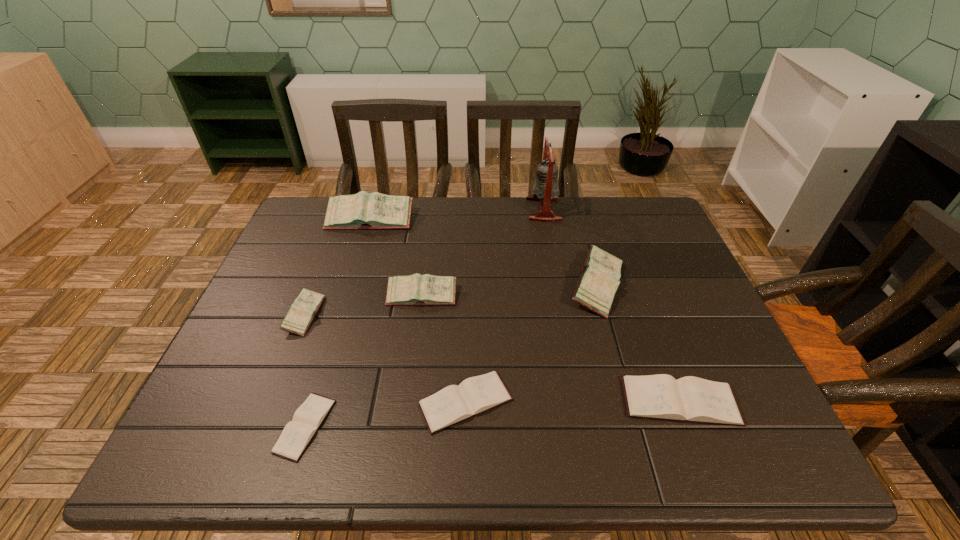
Where is `the rightmost brown diary`? Image resolution: width=960 pixels, height=540 pixels. the rightmost brown diary is located at coordinates (688, 399).

Where is `the seventh tallest object`? The height and width of the screenshot is (540, 960). the seventh tallest object is located at coordinates (455, 403).

Locate an element on the screen. the second smallest brown diary is located at coordinates (455, 403).

Where is `the leftmost brown diary`? This screenshot has width=960, height=540. the leftmost brown diary is located at coordinates (297, 434).

Identify the location of the shortest object. (297, 434).

Locate an element on the screen. vacant space situated 0.210m on the front of the bell is located at coordinates (555, 269).

Identify the location of vacant space positioned 0.300m on the right of the tallest diary. Image resolution: width=960 pixels, height=540 pixels. (510, 220).

Image resolution: width=960 pixels, height=540 pixels. What are the coordinates of `vacant region located 0.100m on the back of the third smallest pink diary` in the screenshot? It's located at (583, 234).

At what (x,y) coordinates should I click in order to perform the action: click on free spot located on the left of the third tallest diary. Please return your answer as a coordinate pair (x, y). This screenshot has width=960, height=540. Looking at the image, I should click on (284, 296).

Where is `free spot located on the right of the fourth shortest object`? The image size is (960, 540). free spot located on the right of the fourth shortest object is located at coordinates (447, 315).